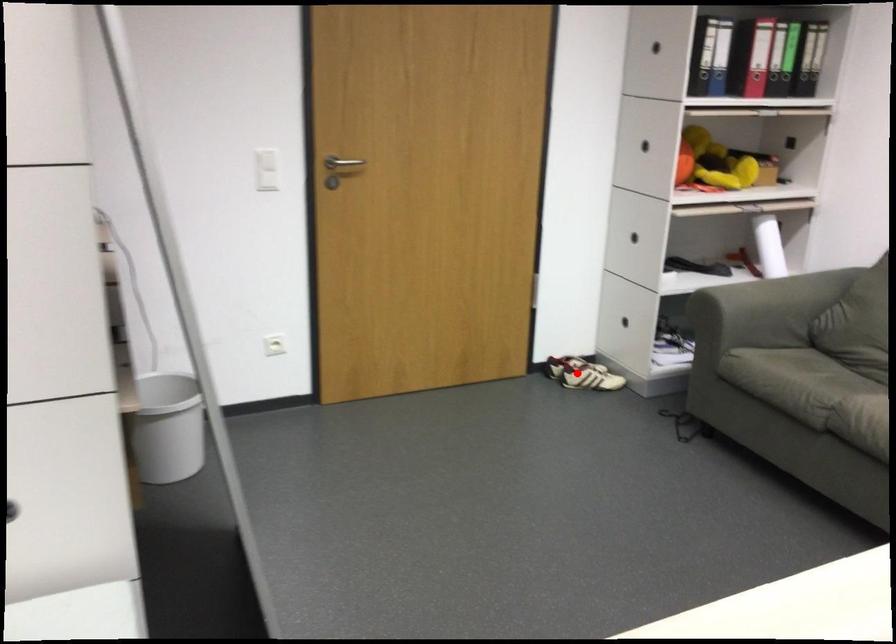
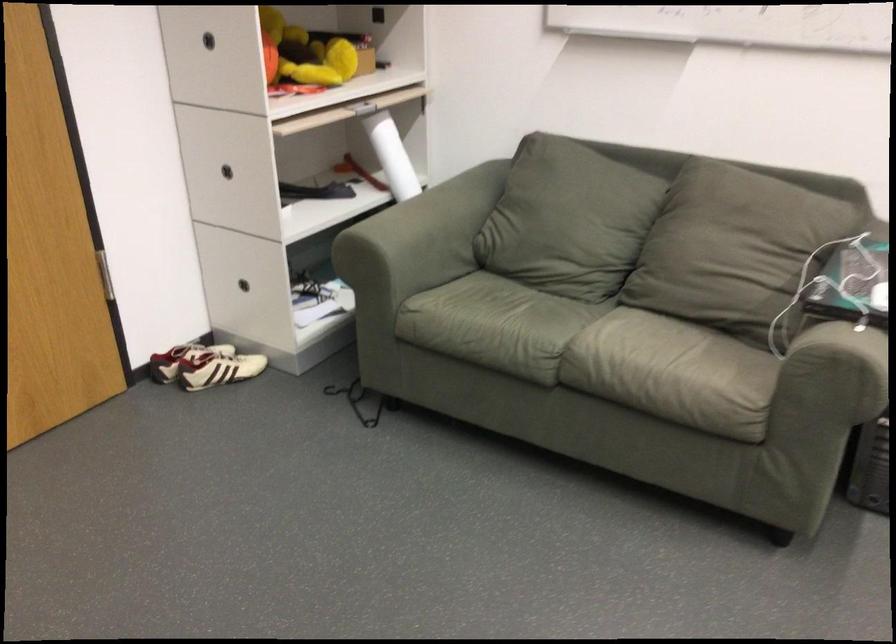
The point at the highlighted location is marked in the first image. Where is the corresponding point in the second image?

(218, 368)